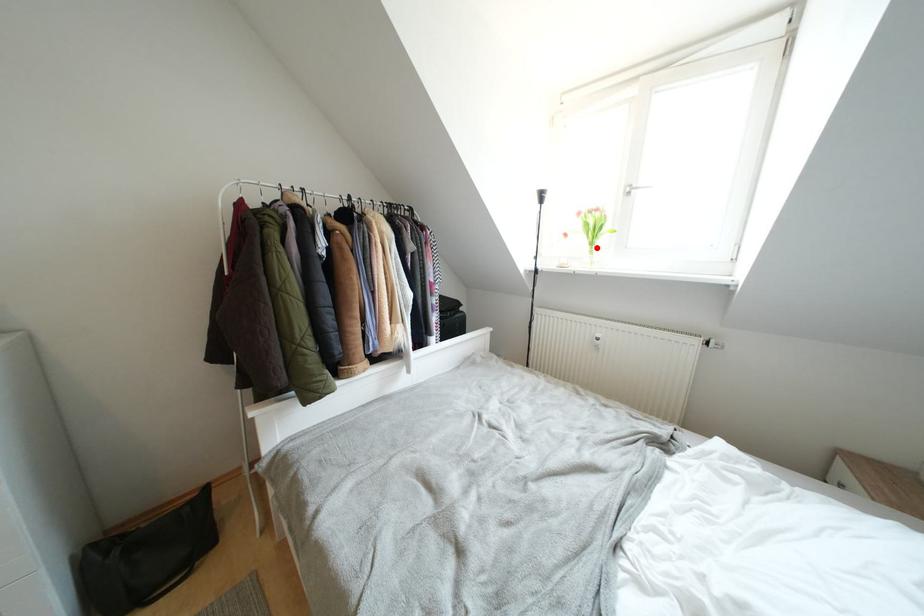
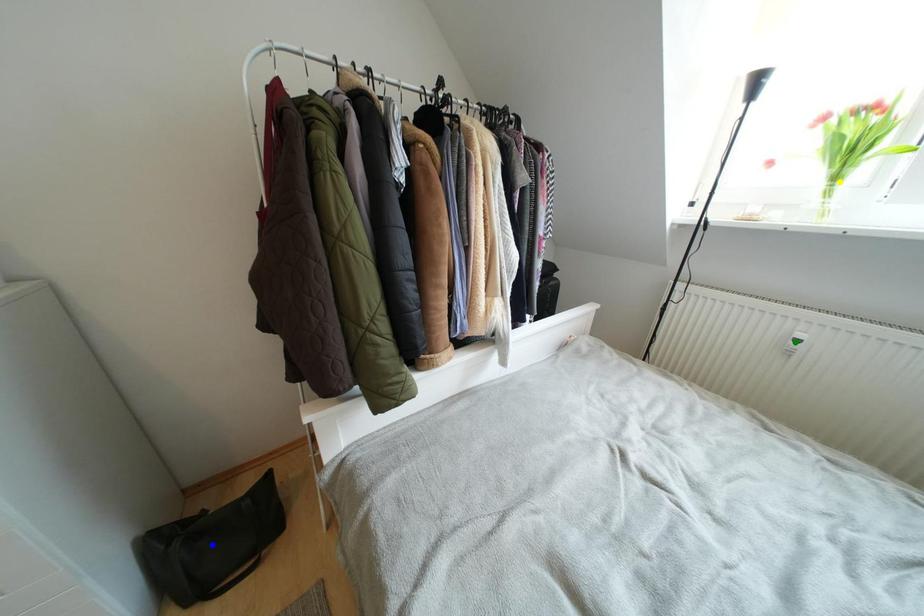
Question: I am providing you with two images of the same scene from different viewpoints. A red point is marked on the first image. You are given multiple points on the second image. Can you choose the point in image 2 that corresponds to the point in image 1?

Choices:
 (A) blue point
 (B) yellow point
 (C) green point

Answer: (B)